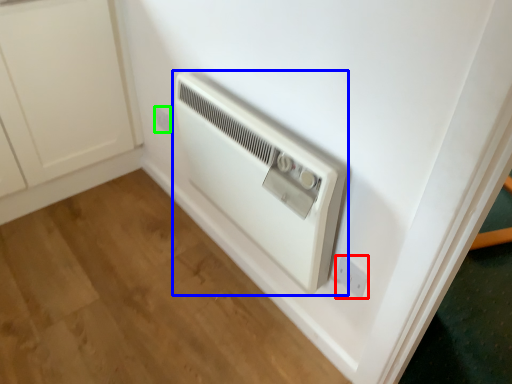
Question: Estimate the real-world distances between objects in this image. Which object is closer to electric outlet (highlighted by a red box), home appliance (highlighted by a blue box) or electric outlet (highlighted by a green box)?

Choices:
 (A) home appliance
 (B) electric outlet

Answer: (A)